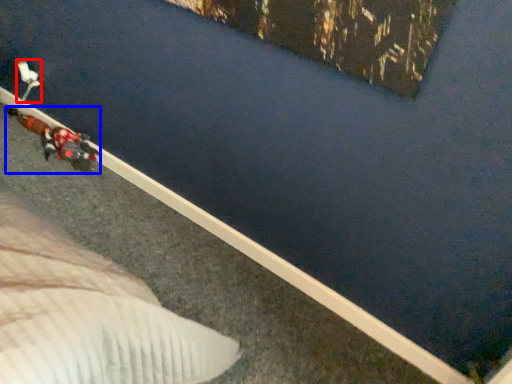
Question: Among these objects, which one is farthest to the camera, toy (highlighted by a red box) or person (highlighted by a blue box)?

Choices:
 (A) toy
 (B) person

Answer: (A)